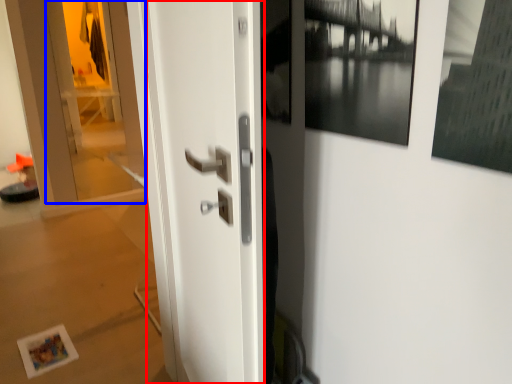
Question: Which of the following is the farthest to the observer, door (highlighted by a red box) or glass door (highlighted by a blue box)?

Choices:
 (A) door
 (B) glass door

Answer: (B)